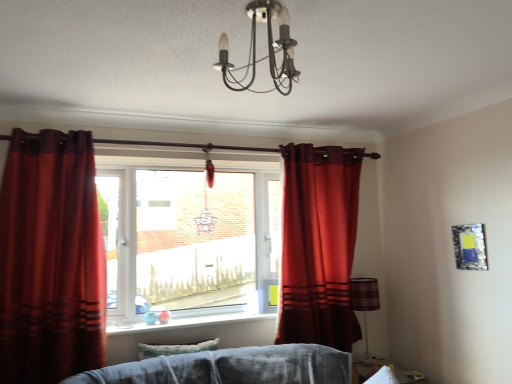
Question: Considering the relative positions of metallic chandelier at upper center and plaid fabric lampshade at lower right in the image provided, is metallic chandelier at upper center to the left of plaid fabric lampshade at lower right from the viewer's perspective?

Choices:
 (A) yes
 (B) no

Answer: (A)

Question: Could you tell me if metallic chandelier at upper center is turned towards plaid fabric lampshade at lower right?

Choices:
 (A) no
 (B) yes

Answer: (A)

Question: Is metallic chandelier at upper center shorter than plaid fabric lampshade at lower right?

Choices:
 (A) yes
 (B) no

Answer: (A)

Question: Does metallic chandelier at upper center have a larger size compared to plaid fabric lampshade at lower right?

Choices:
 (A) yes
 (B) no

Answer: (A)

Question: Is the position of metallic chandelier at upper center more distant than that of plaid fabric lampshade at lower right?

Choices:
 (A) yes
 (B) no

Answer: (B)

Question: Is metallic chandelier at upper center taller than plaid fabric lampshade at lower right?

Choices:
 (A) no
 (B) yes

Answer: (A)

Question: Can you confirm if velvet red curtain at left, the 1th curtain when ordered from front to back, is taller than clear glass window at center?

Choices:
 (A) yes
 (B) no

Answer: (A)

Question: Is the depth of velvet red curtain at left, arranged as the second curtain when viewed from the right, less than that of clear glass window at center?

Choices:
 (A) no
 (B) yes

Answer: (B)

Question: From a real-world perspective, is velvet red curtain at left, the first curtain viewed from the left, positioned over clear glass window at center based on gravity?

Choices:
 (A) yes
 (B) no

Answer: (B)

Question: From the image's perspective, is velvet red curtain at left, the 1th curtain when ordered from front to back, located beneath clear glass window at center?

Choices:
 (A) no
 (B) yes

Answer: (B)

Question: Is velvet red curtain at left, the first curtain viewed from the left, far from clear glass window at center?

Choices:
 (A) yes
 (B) no

Answer: (B)

Question: Is clear glass window at center a part of velvet red curtain at left, the 1th curtain when ordered from front to back?

Choices:
 (A) no
 (B) yes

Answer: (A)

Question: Is matte red curtain at center, arranged as the 1th curtain when viewed from the right, located within velvet red curtain at left, the 1th curtain when ordered from front to back?

Choices:
 (A) yes
 (B) no

Answer: (B)